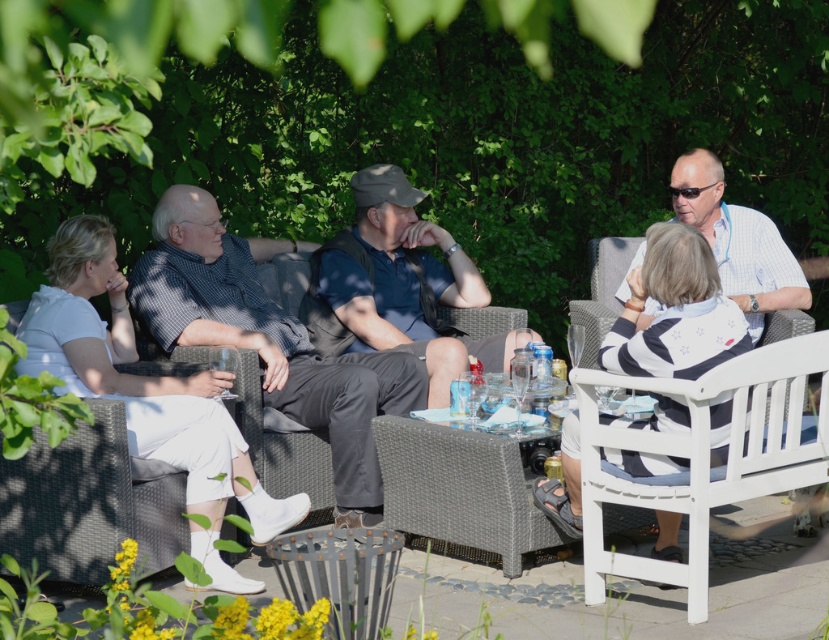
Question: Among these objects, which one is farthest from the camera?

Choices:
 (A) white wood bench at lower right
 (B) light blue checkered shirt at upper right
 (C) matte black shirt at left
 (D) white wicker chair at center

Answer: (B)

Question: Is matte black shirt at left closer to camera compared to light blue checkered shirt at upper right?

Choices:
 (A) yes
 (B) no

Answer: (A)

Question: Is white wicker chair at center positioned before light blue checkered shirt at upper right?

Choices:
 (A) no
 (B) yes

Answer: (B)

Question: Which object appears closest to the camera in this image?

Choices:
 (A) matte black shirt at left
 (B) white wood bench at lower right
 (C) matte blue shirt at center
 (D) white wicker chair at left

Answer: (B)

Question: Which point appears farthest from the camera in this image?

Choices:
 (A) (372, 173)
 (B) (711, 161)

Answer: (A)

Question: Does matte black shirt at left appear over light blue checkered shirt at upper right?

Choices:
 (A) yes
 (B) no

Answer: (B)